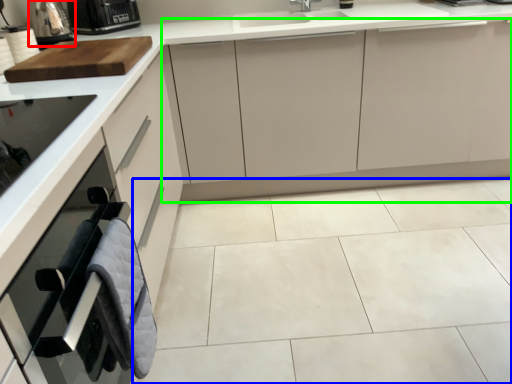
Question: Which object is the closest to the appliance (highlighted by a red box)? Choose among these: ceramic tile (highlighted by a blue box) or cabinetry (highlighted by a green box).

Choices:
 (A) ceramic tile
 (B) cabinetry

Answer: (B)